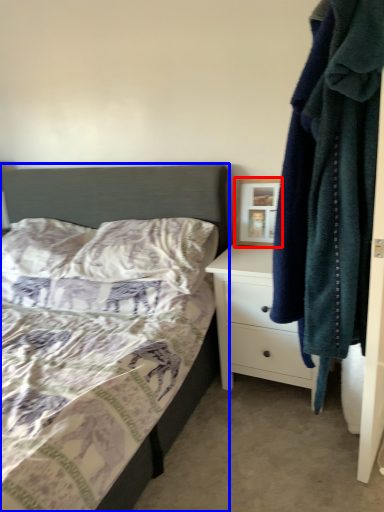
Question: Which point is closer to the camera, picture frame (highlighted by a red box) or bed (highlighted by a blue box)?

Choices:
 (A) picture frame
 (B) bed

Answer: (B)